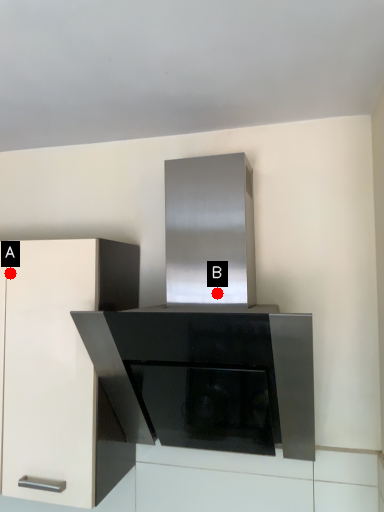
Question: Two points are circled on the image, labeled by A and B beside each circle. Among these points, which one is farthest from the camera?

Choices:
 (A) A is further
 (B) B is further

Answer: (A)